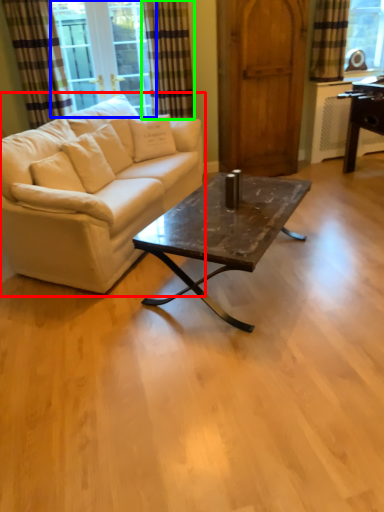
Question: Considering the real-world distances, which object is closest to studio couch (highlighted by a red box)? window screen (highlighted by a blue box) or curtain (highlighted by a green box).

Choices:
 (A) window screen
 (B) curtain

Answer: (B)